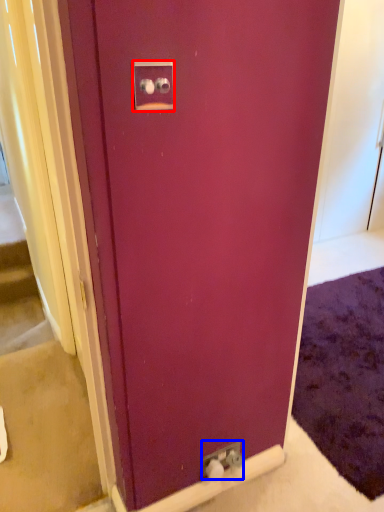
Question: Which of the following is the closest to the observer, electric outlet (highlighted by a red box) or electric outlet (highlighted by a blue box)?

Choices:
 (A) electric outlet
 (B) electric outlet

Answer: (A)